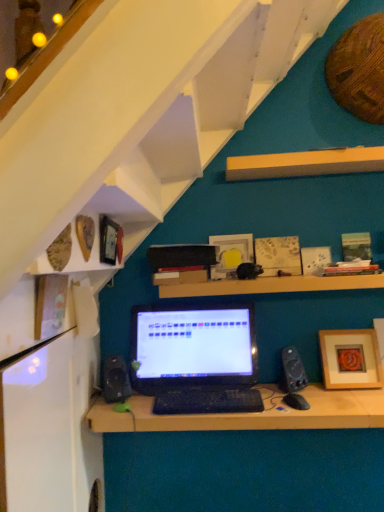
This screenshot has height=512, width=384. In order to click on vacant space to the left of black matte computer mouse at lower right in this screenshot , I will do `click(258, 411)`.